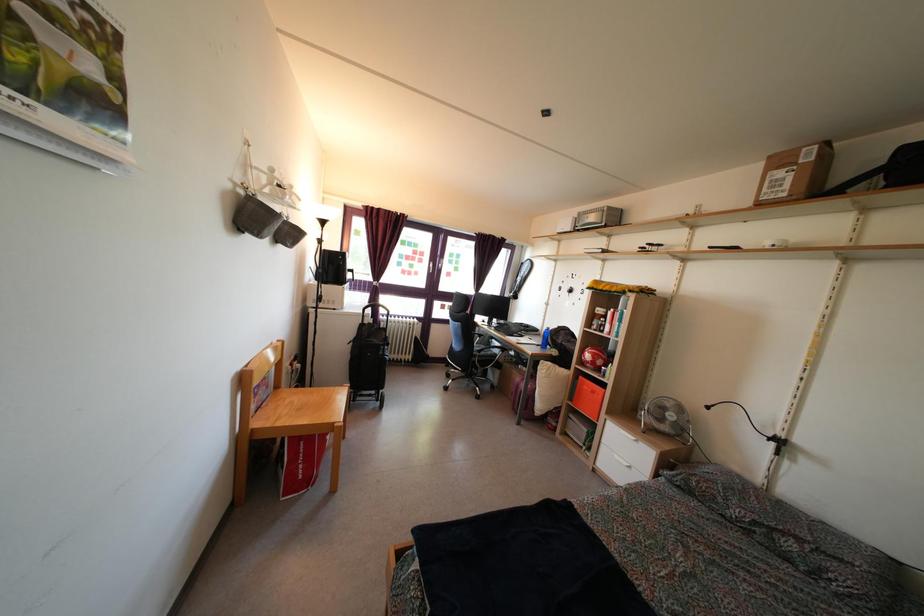
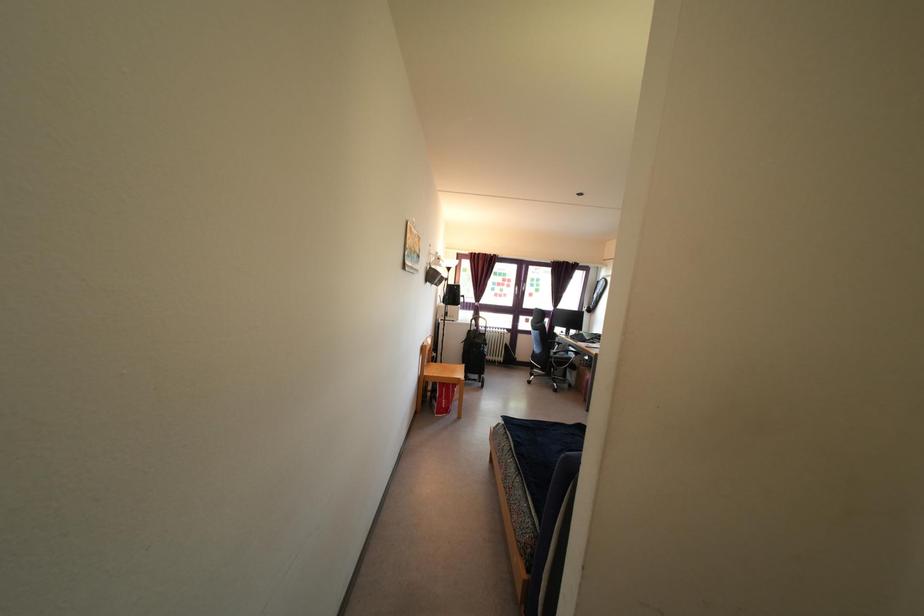
Find the pixel in the second image that matches (x=482, y=360) in the first image.

(557, 362)